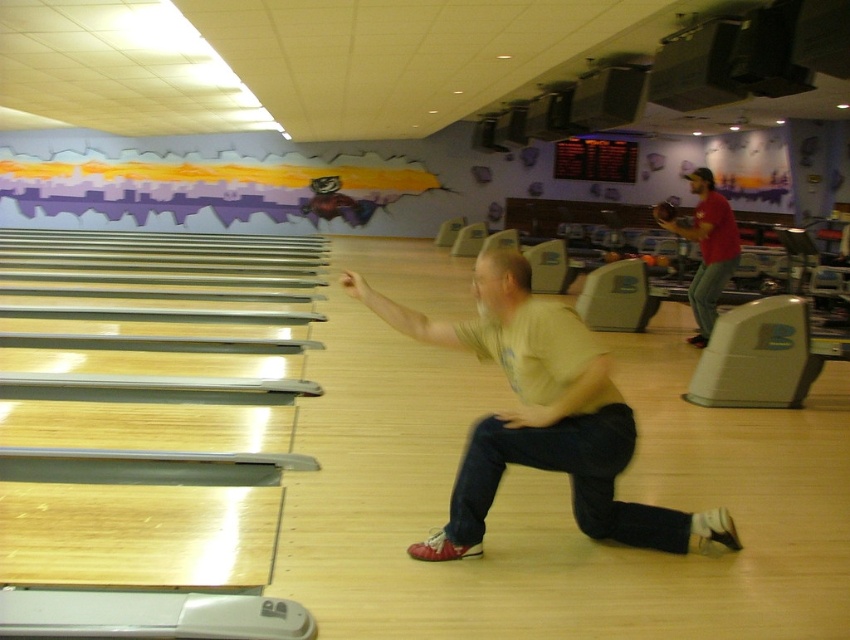
Does light yellow t-shirt at center appear on the right side of red cotton shirt at upper right?

In fact, light yellow t-shirt at center is to the left of red cotton shirt at upper right.

Does light yellow t-shirt at center have a smaller size compared to red cotton shirt at upper right?

Yes.

Is point (582, 467) closer to viewer compared to point (735, 230)?

Yes, it is in front of point (735, 230).

The height and width of the screenshot is (640, 850). Identify the location of light yellow t-shirt at center. (542, 417).